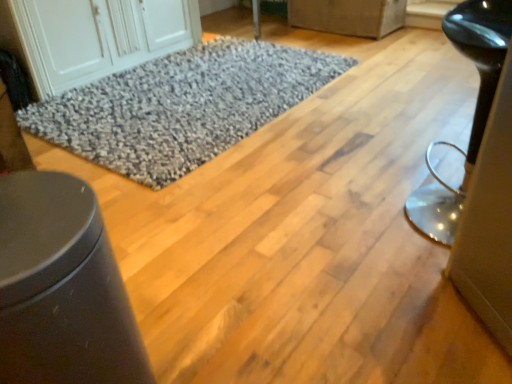
Where is `free area behind glossy black stool at right, which appears as the second furniture when viewed from the top`? Image resolution: width=512 pixels, height=384 pixels. free area behind glossy black stool at right, which appears as the second furniture when viewed from the top is located at coordinates (400, 158).